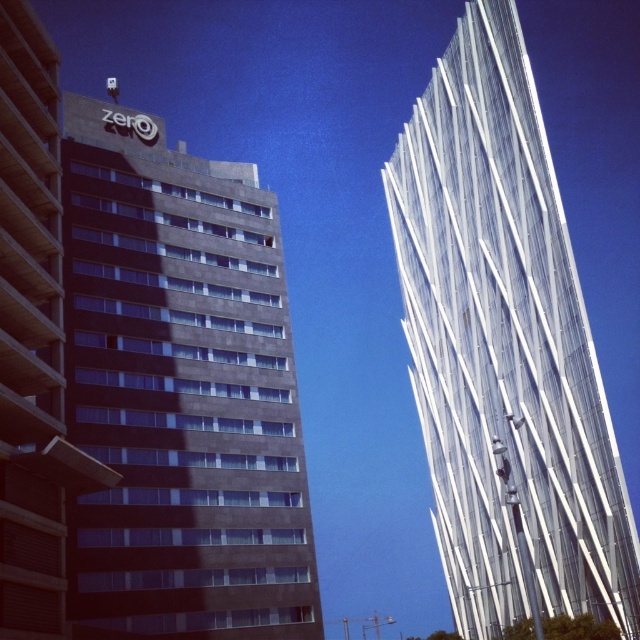
You are a city planner assessing the skyline. Which of the two buildings, the transparent glass tower at right or the dark gray concrete building at left, would cast a longer shadow during midday? Explain your reasoning based on their positions and sizes in the image.

The transparent glass tower at right has a greater height compared to the dark gray concrete building at left. Since taller structures cast longer shadows, the transparent glass tower at right would cast a longer shadow during midday.

You are standing at the origin point of the coordinate system in the image. You want to walk directly to the dark gray concrete building at center. In which direction should you move relative to your current position?

You should move towards the point with coordinates of 0.613 in the x axis and 0.283 in the y axis, so move northeast direction.

In the scene shown: You are standing in the middle of the street between the transparent glass tower at right and the dark gray concrete building at left. Which building is closer to your right side?

The transparent glass tower at right is to the right of the dark gray concrete building at left, so the transparent glass tower at right is closer to your right side.